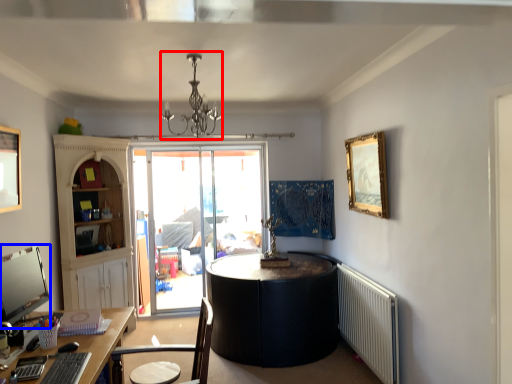
Question: Which point is closer to the camera, light fixture (highlighted by a red box) or computer monitor (highlighted by a blue box)?

Choices:
 (A) light fixture
 (B) computer monitor

Answer: (B)